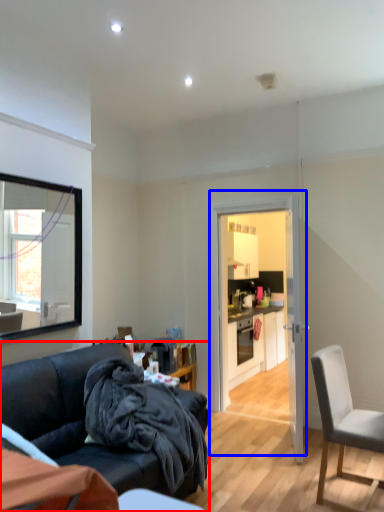
Question: Which of the following is the farthest to the observer, studio couch (highlighted by a red box) or door (highlighted by a blue box)?

Choices:
 (A) studio couch
 (B) door

Answer: (B)